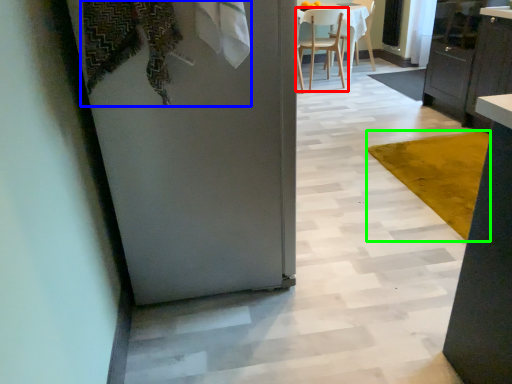
Question: Estimate the real-world distances between objects in this image. Which object is closer to chair (highlighted by a red box), laundry (highlighted by a blue box) or mat (highlighted by a green box)?

Choices:
 (A) laundry
 (B) mat

Answer: (B)